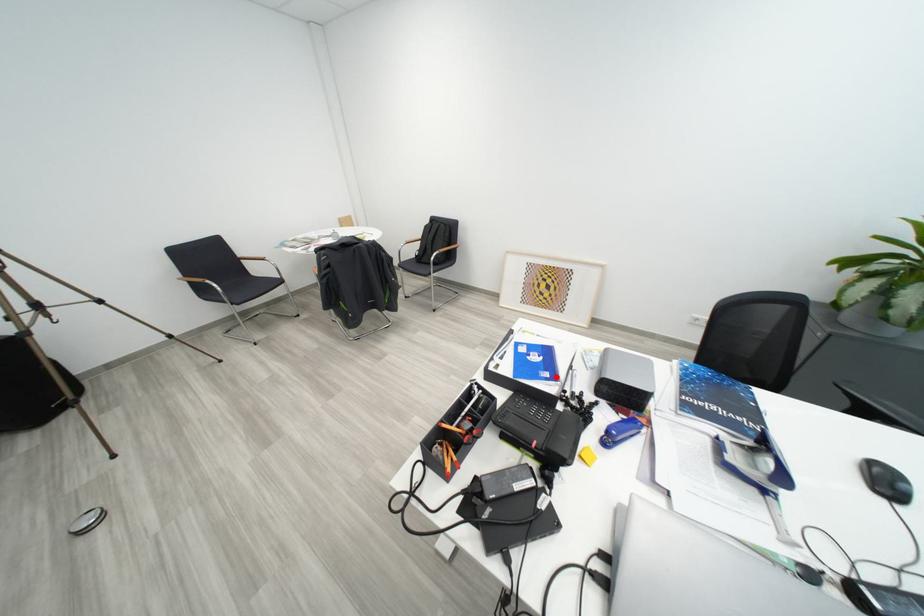
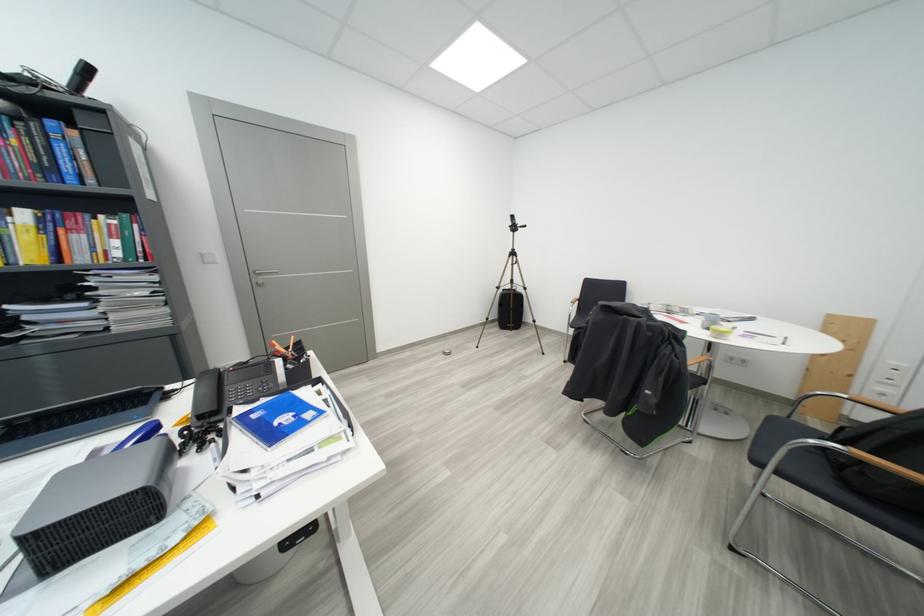
The point at the highlighted location is marked in the first image. Where is the corresponding point in the second image?

(263, 419)